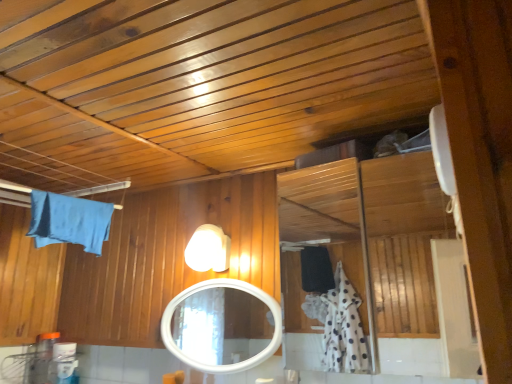
Measure the distance between white glossy mirror at center and camera.

white glossy mirror at center is 2.66 meters away from camera.

Measure the distance between white glossy light fixture at upper center and camera.

white glossy light fixture at upper center is 5.01 feet away from camera.

The height and width of the screenshot is (384, 512). Find the location of `white glossy mirror at center`. white glossy mirror at center is located at coordinates coord(221,326).

Considering the positions of objects white glossy exhaust hood at upper right and white glossy light fixture at upper center in the image provided, who is behind, white glossy exhaust hood at upper right or white glossy light fixture at upper center?

white glossy light fixture at upper center is further from the camera.

Who is shorter, white glossy exhaust hood at upper right or white glossy light fixture at upper center?

Standing shorter between the two is white glossy exhaust hood at upper right.

Are white glossy exhaust hood at upper right and white glossy light fixture at upper center located far from each other?

That's not correct — white glossy exhaust hood at upper right is a little close to white glossy light fixture at upper center.

From a real-world perspective, is white glossy exhaust hood at upper right physically below white glossy light fixture at upper center?

No, from a real-world perspective, white glossy exhaust hood at upper right is not beneath white glossy light fixture at upper center.

Identify the location of exhaust hood above the white glossy mirror at center (from a real-world perspective). (199, 84).

Between white glossy mirror at center and white glossy exhaust hood at upper right, which one appears on the right side from the viewer's perspective?

From the viewer's perspective, white glossy mirror at center appears more on the right side.

From the image's perspective, would you say white glossy mirror at center is shown under white glossy exhaust hood at upper right?

Indeed, from the image's perspective, white glossy mirror at center is shown beneath white glossy exhaust hood at upper right.

Between white glossy mirror at center and white glossy exhaust hood at upper right, which one has smaller size?

With smaller size is white glossy mirror at center.

Is white glossy exhaust hood at upper right bigger than blue fabric bath towel at upper left?

Yes, white glossy exhaust hood at upper right is bigger than blue fabric bath towel at upper left.

You are a GUI agent. You are given a task and a screenshot of the screen. Output one action in this format:
    pyautogui.click(x=<x>, y=<y>)
    Task: Click on the exhaust hood that appears on the right of blue fabric bath towel at upper left
    
    Given the screenshot: What is the action you would take?
    pyautogui.click(x=199, y=84)

Who is shorter, white glossy exhaust hood at upper right or blue fabric bath towel at upper left?

With less height is white glossy exhaust hood at upper right.

Considering the sizes of objects white glossy exhaust hood at upper right and blue fabric bath towel at upper left in the image provided, who is thinner, white glossy exhaust hood at upper right or blue fabric bath towel at upper left?

With smaller width is blue fabric bath towel at upper left.

Is blue fabric bath towel at upper left surrounding white glossy light fixture at upper center?

Definitely not — white glossy light fixture at upper center is not inside blue fabric bath towel at upper left.

Consider the image. Is blue fabric bath towel at upper left taller or shorter than white glossy light fixture at upper center?

In the image, blue fabric bath towel at upper left appears to be taller than white glossy light fixture at upper center.

Which of these two, blue fabric bath towel at upper left or white glossy light fixture at upper center, is thinner?

blue fabric bath towel at upper left is thinner.

From the image's perspective, which is below, blue fabric bath towel at upper left or white glossy light fixture at upper center?

From the image's view, white glossy light fixture at upper center is below.

Between white glossy light fixture at upper center and blue fabric bath towel at upper left, which one is positioned behind?

white glossy light fixture at upper center is more distant.

Consider the image. How distant is white glossy light fixture at upper center from blue fabric bath towel at upper left?

A distance of 45.18 centimeters exists between white glossy light fixture at upper center and blue fabric bath towel at upper left.

Is white glossy light fixture at upper center far from blue fabric bath towel at upper left?

No, white glossy light fixture at upper center is in close proximity to blue fabric bath towel at upper left.

How different are the orientations of white glossy light fixture at upper center and blue fabric bath towel at upper left in degrees?

They differ by 86.4 degrees in their facing directions.

Which is correct: white glossy mirror at center is inside white glossy light fixture at upper center, or outside of it?

white glossy mirror at center is located beyond the bounds of white glossy light fixture at upper center.

Considering the positions of points (234, 288) and (209, 238), is point (234, 288) farther from camera compared to point (209, 238)?

Yes, it is behind point (209, 238).

Could you tell me if white glossy mirror at center is facing white glossy light fixture at upper center?

No, white glossy mirror at center is not aimed at white glossy light fixture at upper center.

From a real-world perspective, does white glossy mirror at center sit lower than white glossy light fixture at upper center?

Indeed, from a real-world perspective, white glossy mirror at center is positioned beneath white glossy light fixture at upper center.

Between white glossy exhaust hood at upper right and white glossy mirror at center, which one is positioned in front?

white glossy exhaust hood at upper right is closer to the camera.

Where is `mirror that appears behind the white glossy exhaust hood at upper right`? This screenshot has width=512, height=384. mirror that appears behind the white glossy exhaust hood at upper right is located at coordinates (221, 326).

Can you tell me how much white glossy exhaust hood at upper right and white glossy mirror at center differ in facing direction?

The facing directions of white glossy exhaust hood at upper right and white glossy mirror at center are 90.2 degrees apart.

This screenshot has width=512, height=384. I want to click on light fixture that is on the right side of white glossy exhaust hood at upper right, so click(208, 249).

The image size is (512, 384). I want to click on exhaust hood in front of the white glossy mirror at center, so click(199, 84).

Estimate the real-world distances between objects in this image. Which object is closer to white glossy mirror at center, white glossy light fixture at upper center or blue fabric bath towel at upper left?

blue fabric bath towel at upper left.

When comparing their distances from white glossy light fixture at upper center, does white glossy mirror at center or blue fabric bath towel at upper left seem closer?

blue fabric bath towel at upper left lies closer to white glossy light fixture at upper center than the other object.

Based on the photo, when comparing their distances from white glossy light fixture at upper center, does blue fabric bath towel at upper left or white glossy exhaust hood at upper right seem further?

white glossy exhaust hood at upper right is positioned further to the anchor white glossy light fixture at upper center.

Which object lies nearer to the anchor point white glossy mirror at center, blue fabric bath towel at upper left or white glossy light fixture at upper center?

Answer: blue fabric bath towel at upper left is positioned closer to the anchor white glossy mirror at center.

Estimate the real-world distances between objects in this image. Which object is further from white glossy light fixture at upper center, white glossy exhaust hood at upper right or blue fabric bath towel at upper left?

white glossy exhaust hood at upper right is further to white glossy light fixture at upper center.

When comparing their distances from blue fabric bath towel at upper left, does white glossy light fixture at upper center or white glossy exhaust hood at upper right seem closer?

white glossy light fixture at upper center lies closer to blue fabric bath towel at upper left than the other object.

Based on their spatial positions, is white glossy mirror at center or white glossy light fixture at upper center closer to white glossy exhaust hood at upper right?

Based on the image, white glossy light fixture at upper center appears to be nearer to white glossy exhaust hood at upper right.

Considering their positions, is white glossy light fixture at upper center positioned further to white glossy mirror at center than white glossy exhaust hood at upper right?

white glossy exhaust hood at upper right is further to white glossy mirror at center.

You are a GUI agent. You are given a task and a screenshot of the screen. Output one action in this format:
    pyautogui.click(x=<x>, y=<y>)
    Task: Click on the bath towel between white glossy exhaust hood at upper right and white glossy light fixture at upper center from front to back
    
    Given the screenshot: What is the action you would take?
    pyautogui.click(x=69, y=221)

Locate an element on the screen. The width and height of the screenshot is (512, 384). mirror between white glossy exhaust hood at upper right and white glossy light fixture at upper center along the z-axis is located at coordinates (221, 326).

I want to click on light fixture located between blue fabric bath towel at upper left and white glossy mirror at center in the left-right direction, so click(208, 249).

This screenshot has width=512, height=384. Find the location of `bath towel between white glossy exhaust hood at upper right and white glossy mirror at center in the front-back direction`. bath towel between white glossy exhaust hood at upper right and white glossy mirror at center in the front-back direction is located at coordinates (69, 221).